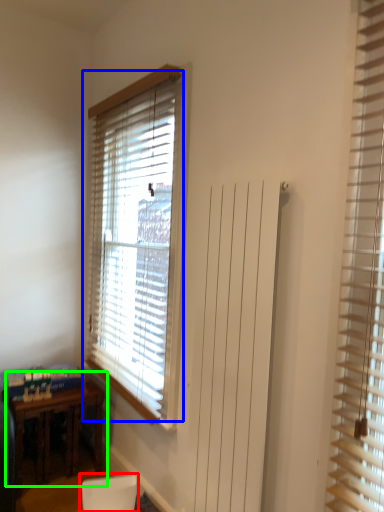
Question: Which object is positioned farthest from armchair (highlighted by a red box)? Select from window blind (highlighted by a blue box) and table (highlighted by a green box).

Choices:
 (A) window blind
 (B) table

Answer: (A)